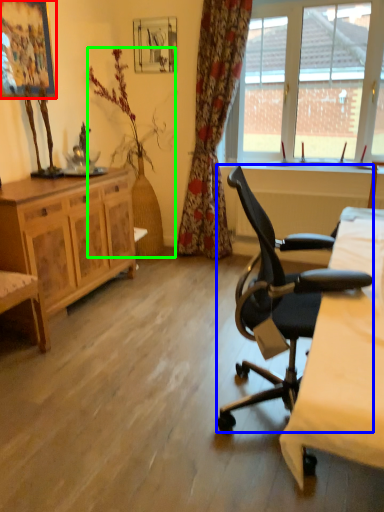
Question: Which object is the closest to the picture frame (highlighted by a red box)? Choose among these: chair (highlighted by a blue box) or houseplant (highlighted by a green box).

Choices:
 (A) chair
 (B) houseplant

Answer: (B)